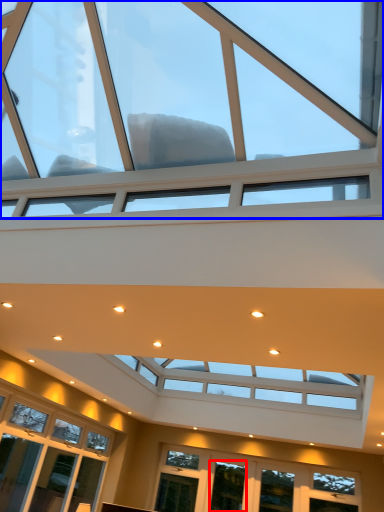
Question: Which of the following is the closest to the observer, window (highlighted by a red box) or window (highlighted by a blue box)?

Choices:
 (A) window
 (B) window

Answer: (B)